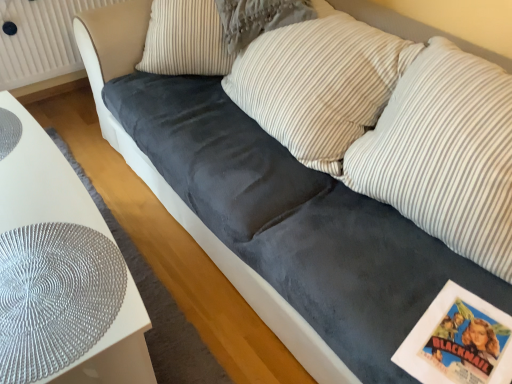
Locate an element on the screen. Image resolution: width=512 pixels, height=384 pixels. free space above white glossy table at lower left (from a real-world perspective) is located at coordinates (38, 218).